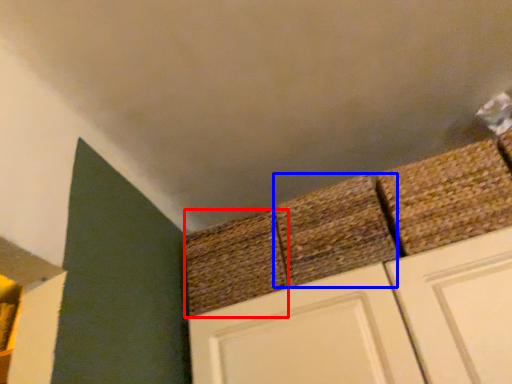
Question: Which of the following is the closest to the observer, brick (highlighted by a red box) or brick (highlighted by a blue box)?

Choices:
 (A) brick
 (B) brick

Answer: (B)